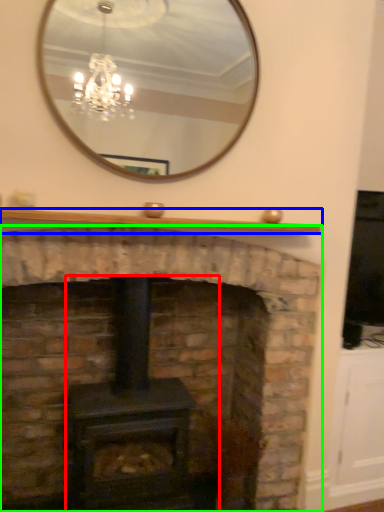
Question: Based on their relative distances, which object is farther from wood burning stove (highlighted by a red box)? Choose from mantle (highlighted by a blue box) and fireplace (highlighted by a green box).

Choices:
 (A) mantle
 (B) fireplace

Answer: (A)